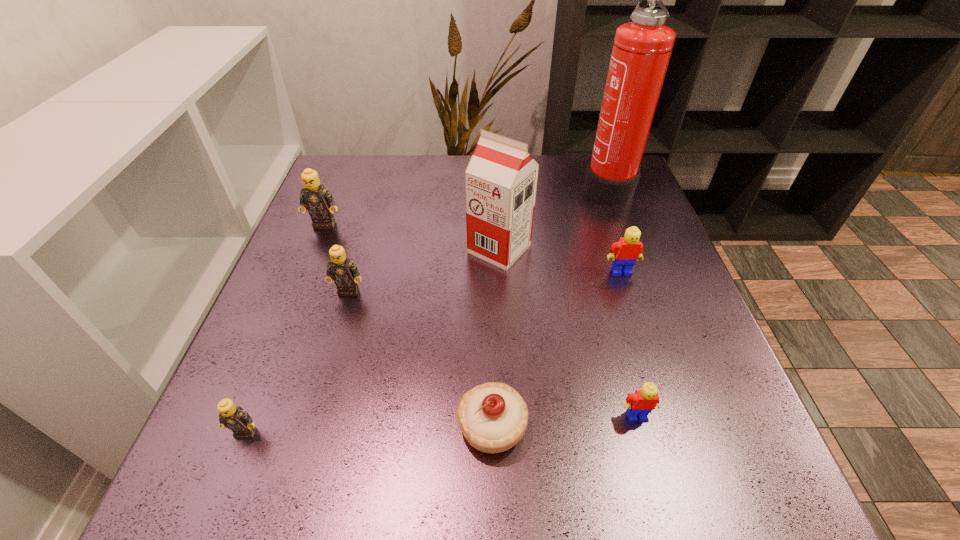
At what (x,y) coordinates should I click in order to perform the action: click on free space at the left edge of the desktop. Please return your answer as a coordinate pair (x, y). Looking at the image, I should click on (283, 403).

At what (x,y) coordinates should I click in order to perform the action: click on vacant space at the right edge of the desktop. Please return your answer as a coordinate pair (x, y). This screenshot has width=960, height=540. Looking at the image, I should click on (668, 427).

Image resolution: width=960 pixels, height=540 pixels. In order to click on vacant region at the far left corner of the desktop in this screenshot , I will do 387,166.

Where is `blank region between the beige pastry and the farthest object`? The image size is (960, 540). blank region between the beige pastry and the farthest object is located at coordinates [x=549, y=305].

Find the location of `unoccupied position between the pastry and the red fire extinguisher`. unoccupied position between the pastry and the red fire extinguisher is located at coordinates (549, 305).

This screenshot has height=540, width=960. I want to click on vacant space that's between the pastry and the farthest Lego, so click(408, 325).

Where is `vacant region between the pastry and the soya milk`? Image resolution: width=960 pixels, height=540 pixels. vacant region between the pastry and the soya milk is located at coordinates (495, 338).

At what (x,y) coordinates should I click in order to perform the action: click on unoccupied position between the pastry and the bigger yellow Lego. Please return your answer as a coordinate pair (x, y). This screenshot has width=960, height=540. Looking at the image, I should click on (557, 349).

Find the location of `vacant space that is in between the tallest object and the smallest tan Lego`. vacant space that is in between the tallest object and the smallest tan Lego is located at coordinates (426, 308).

This screenshot has width=960, height=540. Find the location of `free spot between the second farthest Lego and the second tallest object`. free spot between the second farthest Lego and the second tallest object is located at coordinates (561, 260).